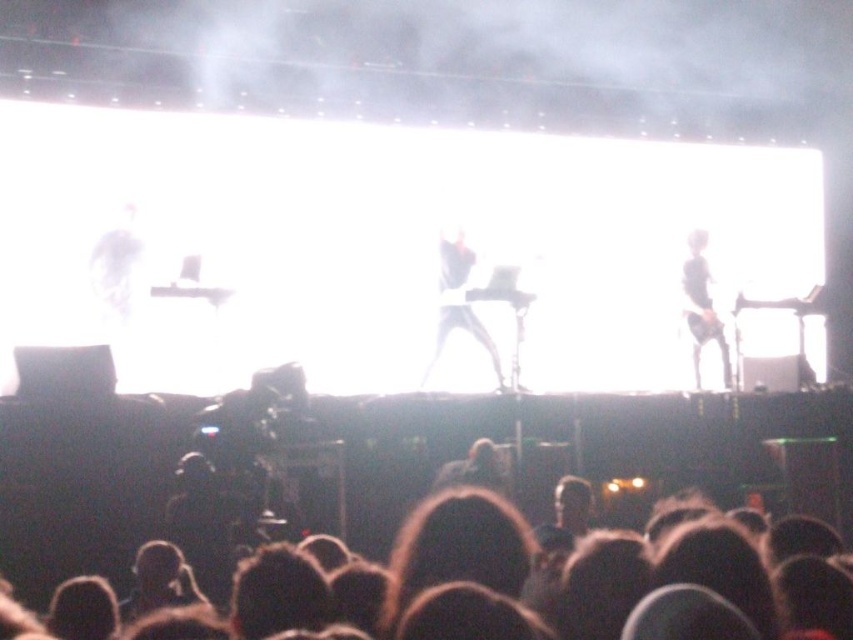
You are a photographer at the concert. You want to take a photo of the black matte guitar at center. Where should you aim your camera?

You should aim your camera at point (457,300) to capture the black matte guitar at center.

You are a stagehand who needs to move the black matte guitar at center and the black matte guitar at right to the storage room. If you start moving from the front of the stage, which guitar should you move first?

The black matte guitar at center should be moved first because it is in front of the black matte guitar at right.

You are standing at the back of the audience and want to move closer to the stage. You see two points marked in the image. Which point, point (451, 305) or point (704, 307), is closer to the stage?

Point (451, 305) is closer to the stage because it is in front of point (704, 307).